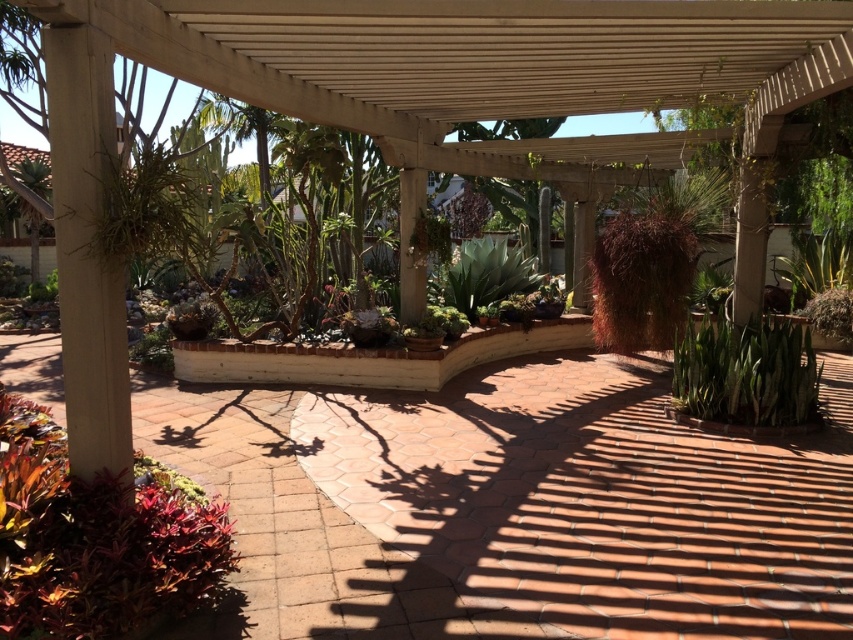
You are standing on the wooden pergola patio and want to place a new potted plant in the exact center of the patio. However, there is already a multicolored leafy plant at lower left located at point (96, 538). Can you determine if the new plant will be placed to the left or right of the existing multicolored leafy plant at lower left?

The new plant will be placed to the right of the existing multicolored leafy plant at lower left because the center of the patio is located to the right of point (96, 538) where the existing plant is placed.

You are standing at the center of the wooden pergola patio. There is a point marked at coordinates (96, 538). What object is located at that point?

The point at coordinates (96, 538) corresponds to the multicolored leafy plant at lower left.

You are standing on the wooden pergola roof and want to walk down to the terracotta tile path at center. Which direction should you go to reach it?

You should go down towards the terracotta tile path at center since it is located at point (514, 508), which is below the pergola roof.